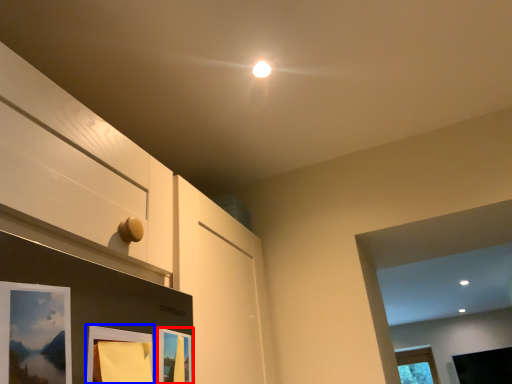
Question: Which object is further to the camera taking this photo, picture frame (highlighted by a red box) or picture frame (highlighted by a blue box)?

Choices:
 (A) picture frame
 (B) picture frame

Answer: (A)